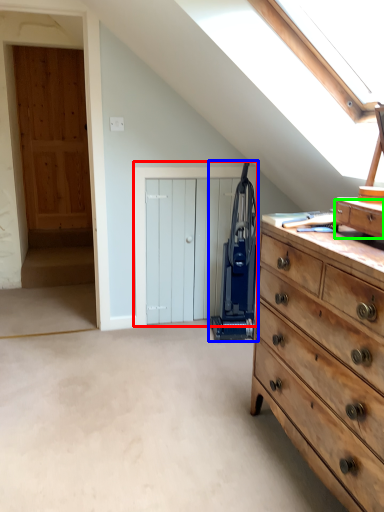
Question: Estimate the real-world distances between objects in this image. Which object is farther from door (highlighted by a red box), appliance (highlighted by a blue box) or drawer (highlighted by a green box)?

Choices:
 (A) appliance
 (B) drawer

Answer: (B)